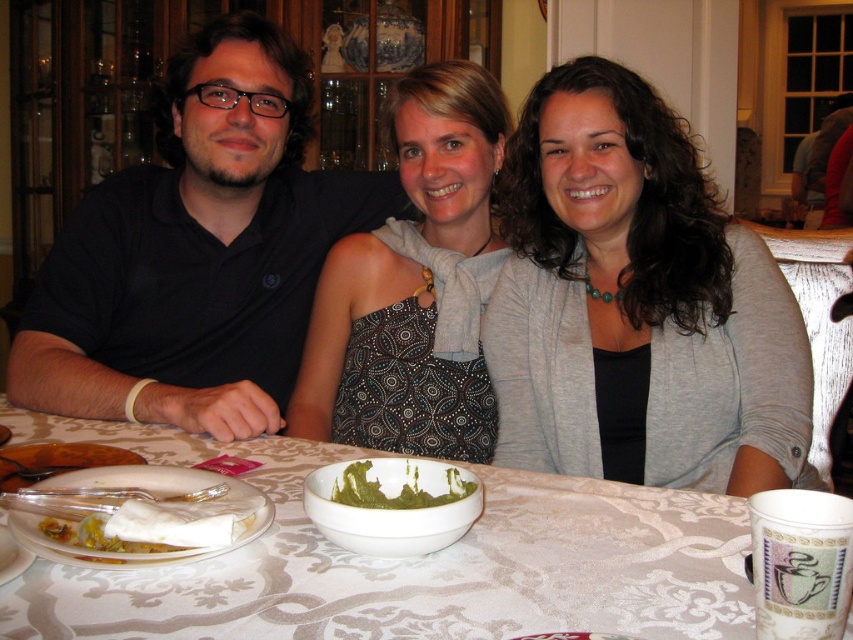
You are sitting at the dining table and want to place a small vase on the white lace tablecloth at center. However, there is a matte black shirt at left nearby. To ensure the vase doesn not fall off, which object should you place it closer to?

The white lace tablecloth at center is in front of the matte black shirt at left, so placing the vase closer to the white lace tablecloth at center would be safer as it is the flat surface where the vase belongs.

You are planning to place a decorative centerpiece on the white lace tablecloth at center. Considering the size of the tablecloth, will it fit if the centerpiece is larger than the matte black shirt at left?

The white lace tablecloth at center is smaller than the matte black shirt at left. Since the centerpiece is larger than the matte black shirt at left, it will not fit on the tablecloth.

From the picture: You are a guest at this table and want to place your napkin on the white lace tablecloth at center. Where should you place it in relation to the matte black shirt at left?

The white lace tablecloth at center is located below the matte black shirt at left, so you should place your napkin on the tablecloth under the shirt.